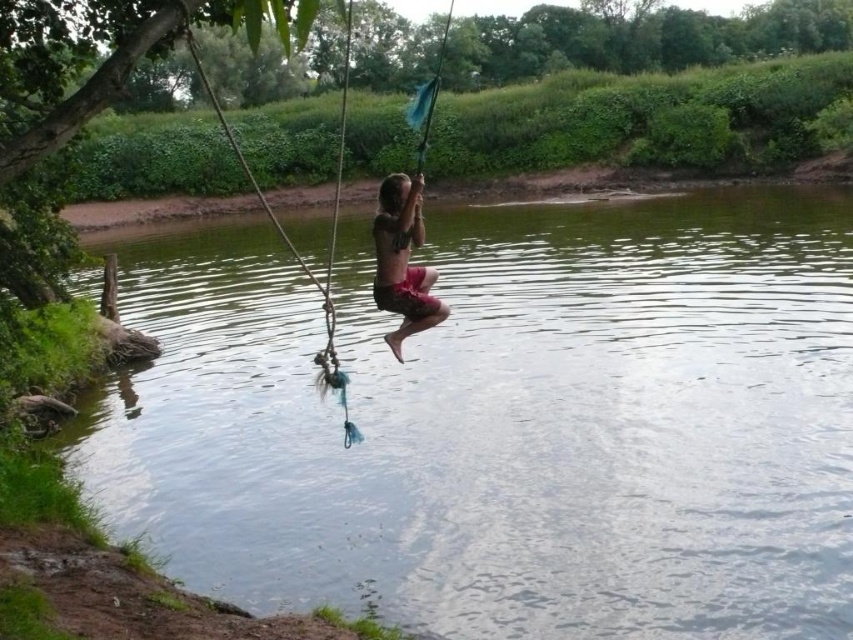
Is clear water at center to the right of matte red shorts at center from the viewer's perspective?

Incorrect, clear water at center is not on the right side of matte red shorts at center.

Does clear water at center appear under matte red shorts at center?

No, clear water at center is not below matte red shorts at center.

Who is more distant from viewer, (503,461) or (396,276)?

The point (503,461) is behind.

You are a GUI agent. You are given a task and a screenshot of the screen. Output one action in this format:
    pyautogui.click(x=<x>, y=<y>)
    Task: Click on the clear water at center
    
    Given the screenshot: What is the action you would take?
    pyautogui.click(x=503, y=422)

Who is lower down, rope swing at center or matte red shorts at center?

matte red shorts at center is below.

Can you confirm if rope swing at center is wider than matte red shorts at center?

Indeed, rope swing at center has a greater width compared to matte red shorts at center.

Where is `rope swing at center`? The height and width of the screenshot is (640, 853). rope swing at center is located at coordinates (288, 237).

Can you confirm if clear water at center is positioned to the right of rope swing at center?

Correct, you'll find clear water at center to the right of rope swing at center.

Which is more to the right, clear water at center or rope swing at center?

clear water at center is more to the right.

The width and height of the screenshot is (853, 640). What do you see at coordinates (503, 422) in the screenshot?
I see `clear water at center` at bounding box center [503, 422].

I want to click on clear water at center, so 503,422.